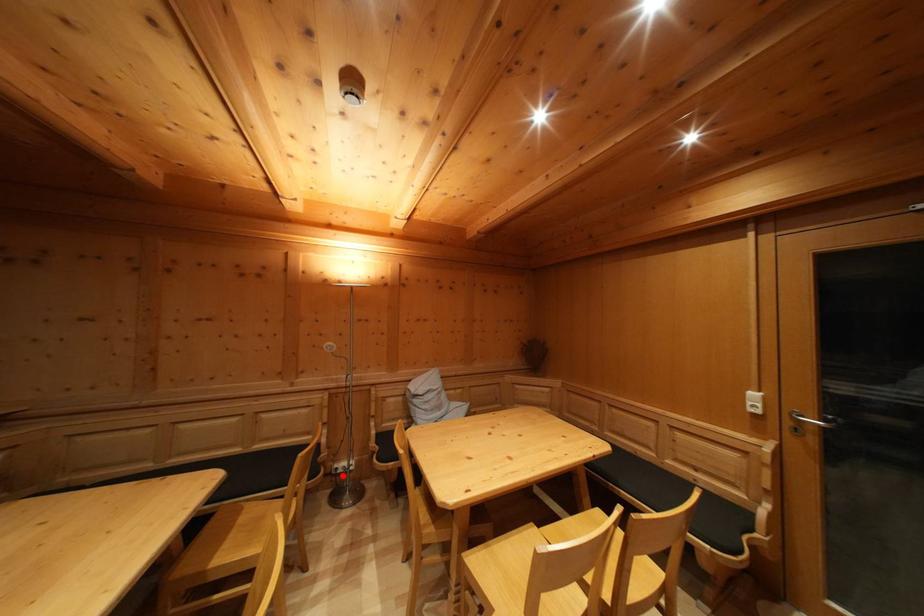
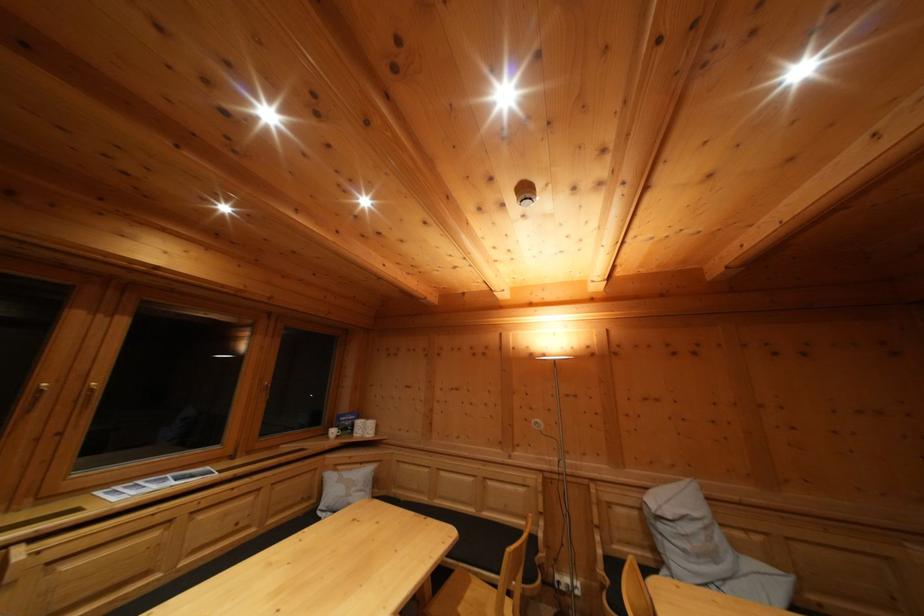
Where in the second image is the point corresponding to the highlighted location from the first image?

(565, 590)